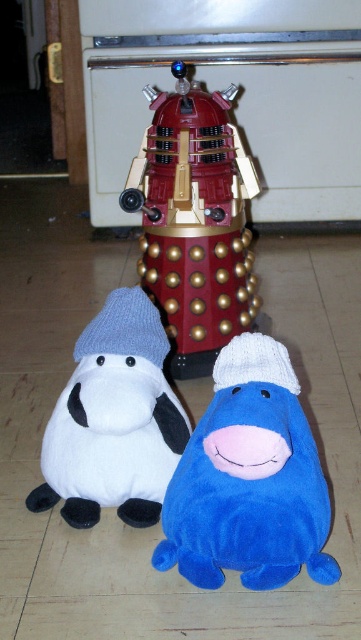
Which is below, white plush sheep at lower left or gray knitted hat at center?

white plush sheep at lower left is below.

Where is `white plush sheep at lower left`? white plush sheep at lower left is located at coordinates (114, 420).

Locate an element on the screen. This screenshot has width=361, height=640. white plush sheep at lower left is located at coordinates (114, 420).

Between point (225, 307) and point (93, 369), which one is positioned behind?

Point (225, 307)

Does point (175, 314) come in front of point (111, 428)?

No.

The width and height of the screenshot is (361, 640). What are the coordinates of `metallic gold dalek at center` in the screenshot? It's located at (193, 220).

I want to click on metallic gold dalek at center, so click(193, 220).

What do you see at coordinates (249, 480) in the screenshot? I see `velvety blue plush at lower center` at bounding box center [249, 480].

Is velvety blue plush at lower center behind metallic gold dalek at center?

No.

Which is behind, point (216, 385) or point (232, 132)?

The point (232, 132) is more distant.

The image size is (361, 640). Identify the location of velvety blue plush at lower center. (249, 480).